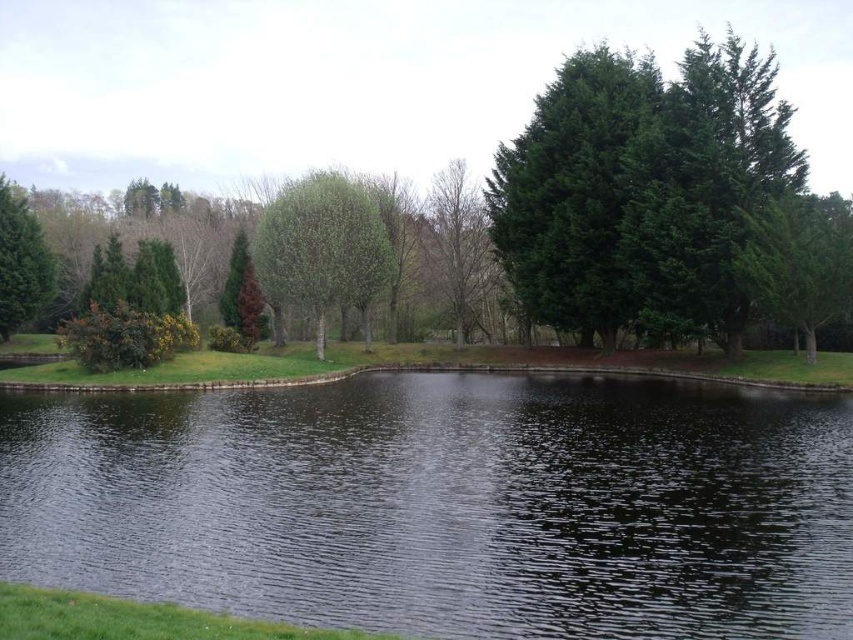
Question: Does green leafy tree at center have a smaller size compared to bare branches at center?

Choices:
 (A) yes
 (B) no

Answer: (A)

Question: Based on their relative distances, which object is nearer to the green leafy tree at center?

Choices:
 (A) dark reflective water at center
 (B) green matte tree at upper left

Answer: (A)

Question: Does dark reflective water at center lie in front of green matte tree at upper left?

Choices:
 (A) no
 (B) yes

Answer: (B)

Question: Is the position of dark reflective water at center less distant than that of bare branches at center?

Choices:
 (A) yes
 (B) no

Answer: (A)

Question: Which is farther from the green leafy tree at center?

Choices:
 (A) green matte tree at upper left
 (B) dark reflective water at center
 (C) bare branches at center

Answer: (A)

Question: Estimate the real-world distances between objects in this image. Which object is closer to the green leafy tree at center?

Choices:
 (A) bare branches at center
 (B) green matte tree at upper left

Answer: (A)